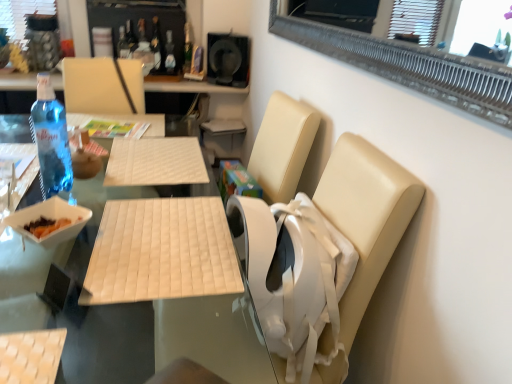
Question: Relative to blue glass bottle at left, arranged as the 4th bottle when viewed from the top, is clear glass bottle at upper center, the third bottle ordered from the bottom, in front or behind?

Choices:
 (A) front
 (B) behind

Answer: (B)

Question: In terms of height, does clear glass bottle at upper center, acting as the 2th bottle starting from the front, look taller or shorter compared to blue glass bottle at left, arranged as the 4th bottle when viewed from the top?

Choices:
 (A) short
 (B) tall

Answer: (A)

Question: Estimate the real-world distances between objects in this image. Which object is farther from the black matte speaker at upper center?

Choices:
 (A) clear glass bottle at upper center, acting as the 2th bottle starting from the front
 (B) translucent glass bottle at upper center, which appears as the 1th bottle when viewed from the top
 (C) transparent plastic bottle at upper center, the second bottle in the bottom-to-top sequence
 (D) white leather chair at right
 (E) blue glass bottle at left, the first bottle from the bottom

Answer: (D)

Question: Estimate the real-world distances between objects in this image. Which object is closer to the white leather chair at right?

Choices:
 (A) transparent plastic bottle at upper center, which is the third bottle in front-to-back order
 (B) translucent glass bottle at upper center, which appears as the 1th bottle when viewed from the top
 (C) blue glass bottle at left, the 1th bottle in the front-to-back sequence
 (D) beige woven fabric armchair at lower left
 (E) white quilted mat at center, marked as the first table in a top-to-bottom arrangement

Answer: (E)